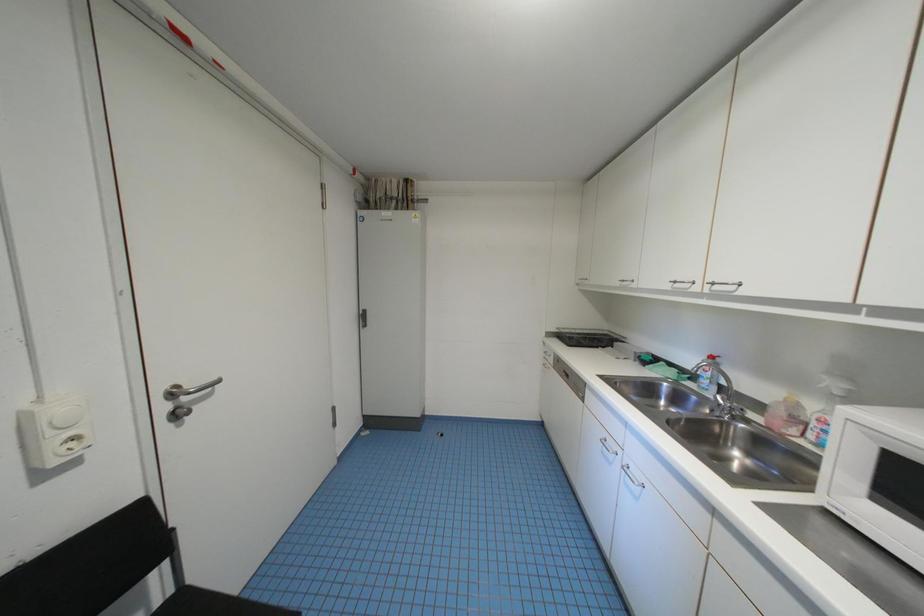
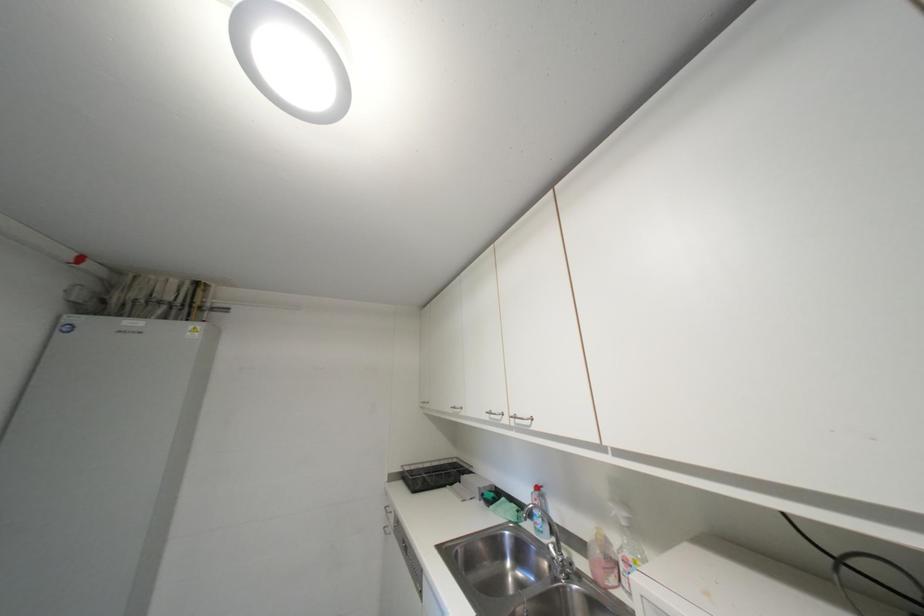
The first image is from the beginning of the video and the second image is from the end. How did the camera likely rotate when shooting the video?

The camera's rotation is toward right-up.